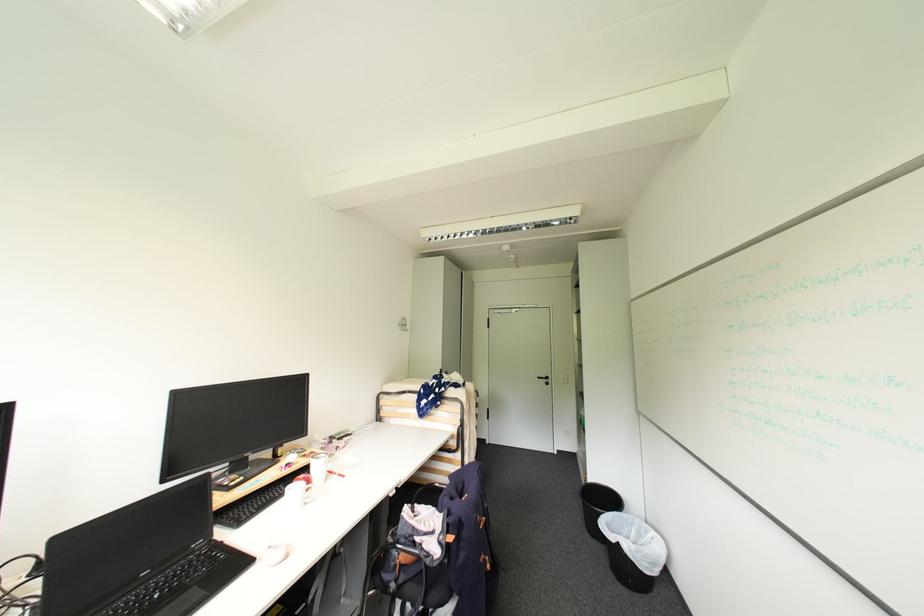
The image size is (924, 616). I want to click on red pen, so click(x=335, y=472).